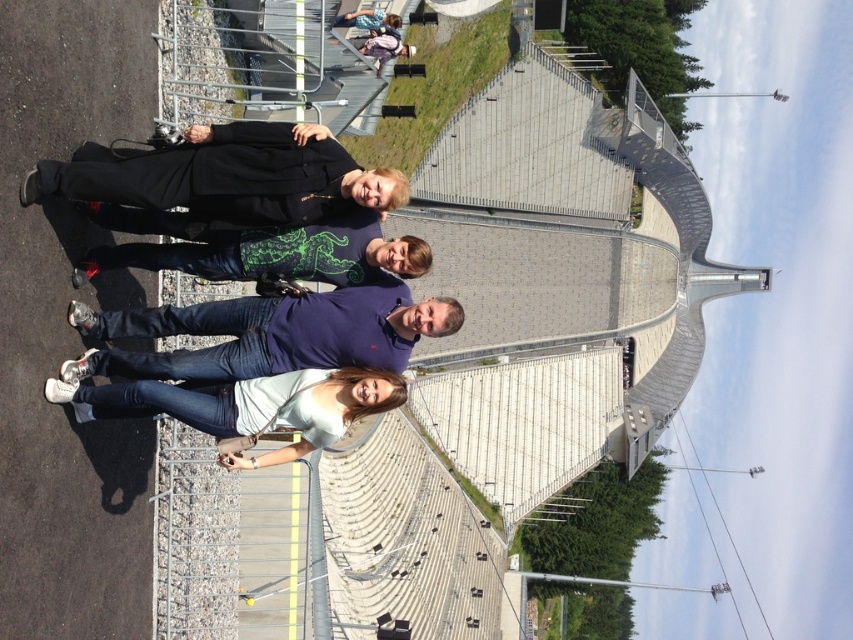
Is black matte jacket at upper left shorter than purple cotton polo shirt at center?

No.

The image size is (853, 640). What do you see at coordinates (227, 177) in the screenshot?
I see `black matte jacket at upper left` at bounding box center [227, 177].

I want to click on black matte jacket at upper left, so click(227, 177).

Is light blue denim jeans at lower center above green matte shirt at center?

No.

What are the coordinates of `light blue denim jeans at lower center` in the screenshot? It's located at (248, 406).

Who is more forward, (254,435) or (376,234)?

Positioned in front is point (254,435).

Where is `light blue denim jeans at lower center`? light blue denim jeans at lower center is located at coordinates (248, 406).

Does purple cotton polo shirt at center have a larger size compared to green matte shirt at center?

Yes.

Does purple cotton polo shirt at center come behind green matte shirt at center?

No.

You are a GUI agent. You are given a task and a screenshot of the screen. Output one action in this format:
    pyautogui.click(x=<x>, y=<y>)
    Task: Click on the purple cotton polo shirt at center
    This screenshot has width=853, height=640.
    Given the screenshot: What is the action you would take?
    pyautogui.click(x=273, y=333)